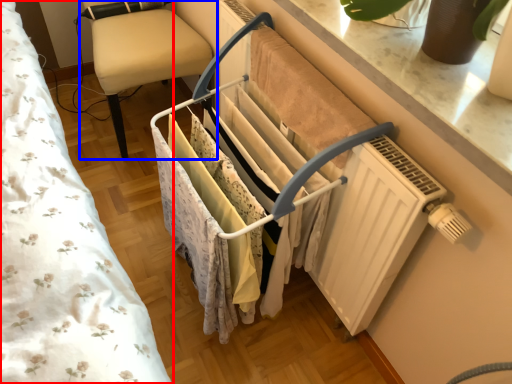
Question: Which object is further to the camera taking this photo, bed (highlighted by a red box) or furniture (highlighted by a blue box)?

Choices:
 (A) bed
 (B) furniture

Answer: (B)